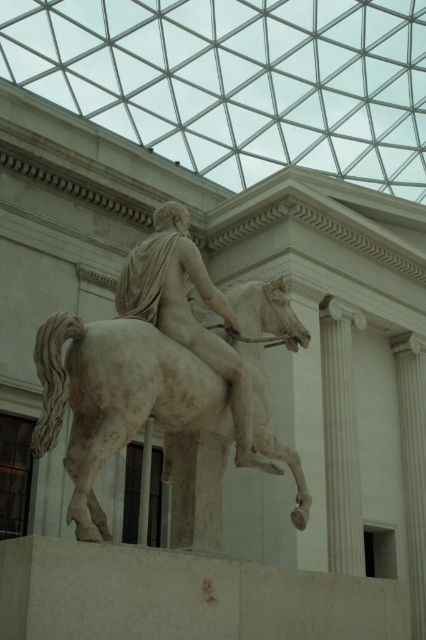
Is white marble statue at center taller than white marble column at center?

Incorrect, white marble statue at center's height is not larger of white marble column at center's.

Does point (123, 276) come in front of point (342, 572)?

Yes, it is.

Locate an element on the screen. The height and width of the screenshot is (640, 426). white marble statue at center is located at coordinates (189, 314).

Is the position of white marble horse at center less distant than that of white marble statue at center?

Yes, white marble horse at center is closer to the viewer.

Where is `white marble horse at center`? This screenshot has width=426, height=640. white marble horse at center is located at coordinates (118, 400).

Where is `white marble horse at center`? This screenshot has width=426, height=640. white marble horse at center is located at coordinates (118, 400).

Can you confirm if white marble horse at center is smaller than white marble column at center?

Yes, white marble horse at center is smaller than white marble column at center.

From the picture: Does white marble horse at center have a lesser height compared to white marble column at center?

Indeed, white marble horse at center has a lesser height compared to white marble column at center.

Is point (247, 300) closer to camera compared to point (344, 449)?

Yes, it is in front of point (344, 449).

Identify the location of white marble horse at center. The height and width of the screenshot is (640, 426). (118, 400).